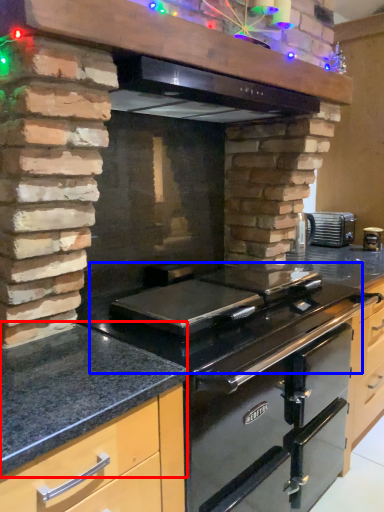
Question: Which point is further to the camera, countertop (highlighted by a red box) or gas stove (highlighted by a blue box)?

Choices:
 (A) countertop
 (B) gas stove

Answer: (B)